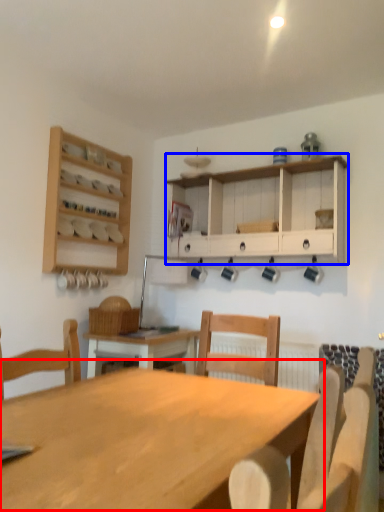
Question: Among these objects, which one is nearest to the camera, table (highlighted by a red box) or cabinetry (highlighted by a blue box)?

Choices:
 (A) table
 (B) cabinetry

Answer: (A)